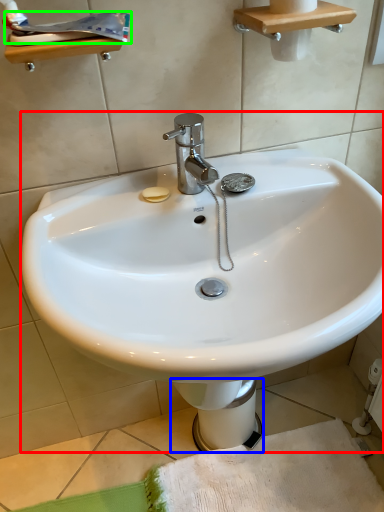
Question: Which object is the closest to the sink (highlighted by a red box)? Choose among these: bidet (highlighted by a blue box) or toothpaste (highlighted by a green box).

Choices:
 (A) bidet
 (B) toothpaste

Answer: (A)